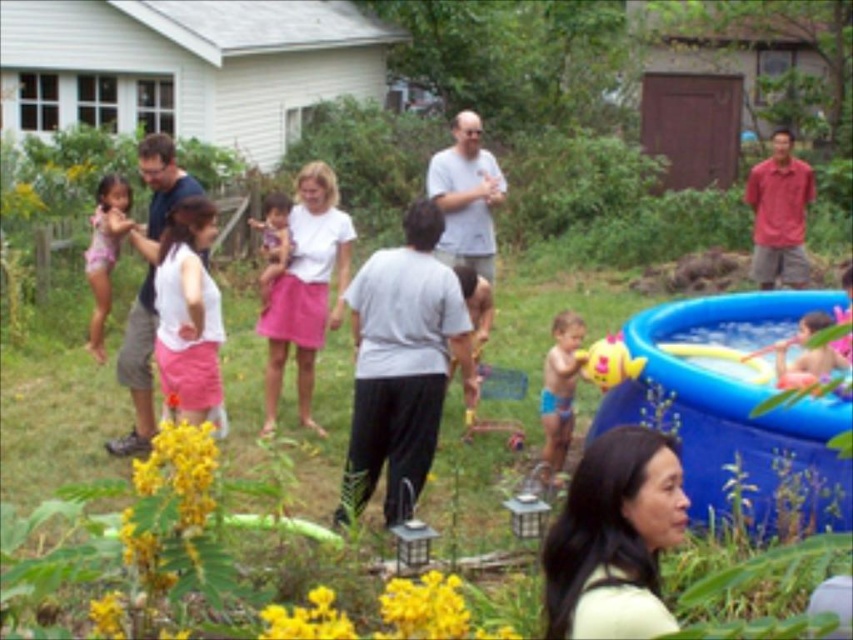
Does point (144, 224) lie behind point (775, 362)?

Yes.

Find the location of a particular element. Image resolution: width=853 pixels, height=640 pixels. matte gray shirt at left is located at coordinates (146, 284).

Find the location of a particular element. The width and height of the screenshot is (853, 640). matte gray shirt at left is located at coordinates (146, 284).

Can you confirm if white cotton shirt at center is thinner than blue fabric shorts at center?

In fact, white cotton shirt at center might be wider than blue fabric shorts at center.

Looking at this image, is white cotton shirt at center closer to the viewer compared to blue fabric shorts at center?

No, white cotton shirt at center is behind blue fabric shorts at center.

Based on the photo, measure the distance between point (320, 252) and camera.

Point (320, 252) is 27.24 feet from camera.

Identify the location of white cotton shirt at center. [x=306, y=289].

Is smooth plastic toy at right further to the viewer compared to yellow rubber duck at right?

No, smooth plastic toy at right is in front of yellow rubber duck at right.

Is smooth plastic toy at right above yellow rubber duck at right?

Yes, smooth plastic toy at right is above yellow rubber duck at right.

Measure the distance between smooth plastic toy at right and camera.

The distance of smooth plastic toy at right from camera is 6.57 meters.

Find the location of a particular element. This screenshot has width=853, height=640. smooth plastic toy at right is located at coordinates (808, 355).